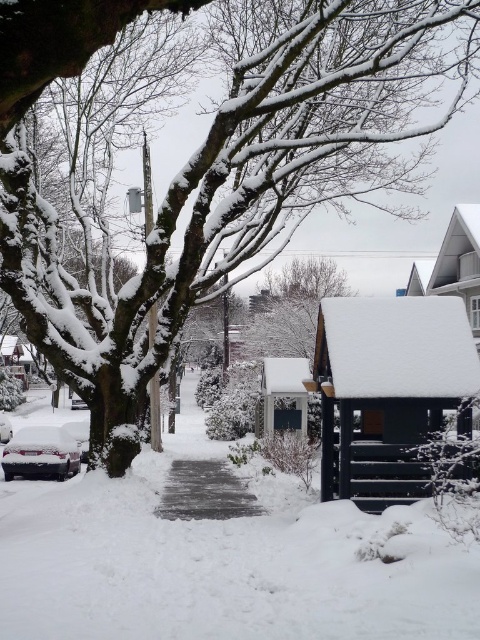
You are a delivery robot with a 2 meter long package. You need to move from the white fluffy snow at center to the gray concrete pavement at center. Can you move the package without it getting stuck?

The distance between the white fluffy snow at center and gray concrete pavement at center is 1.87 meters. Since the package is 2 meters long, it will extend beyond the 1.87 meter gap, causing it to get stuck. Therefore, the package cannot be moved without getting stuck.